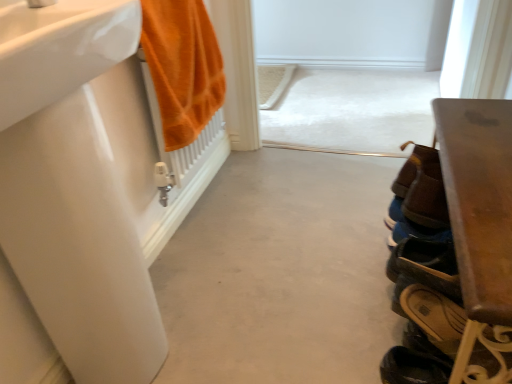
Question: Looking at the image, does white glossy sink at left, the second sink positioned from the bottom, seem bigger or smaller compared to orange cotton towel at left?

Choices:
 (A) small
 (B) big

Answer: (A)

Question: Is white glossy sink at left, acting as the first sink starting from the top, taller or shorter than orange cotton towel at left?

Choices:
 (A) tall
 (B) short

Answer: (B)

Question: Based on their relative distances, which object is farther from the brown leather shoe at lower right, the first shoe viewed from the front?

Choices:
 (A) gray matte concrete at center
 (B) white glossy sink at left, the second sink when ordered from top to bottom
 (C) beige leather sandals at lower right, positioned as the second footwear in top-to-bottom order
 (D) brown wooden bench at right
 (E) brown leather shoe at lower right, which is counted as the 2th footwear, starting from the bottom

Answer: (B)

Question: Based on their relative distances, which object is farther from the white glossy sink at left, the second sink positioned from the bottom?

Choices:
 (A) brown leather shoe at lower right, which is counted as the 2th footwear, starting from the bottom
 (B) brown wooden bench at right
 (C) white glossy sink at left, the second sink when ordered from top to bottom
 (D) gray matte concrete at center
 (E) brown leather shoe at lower right, the 2th shoe when ordered from back to front

Answer: (E)